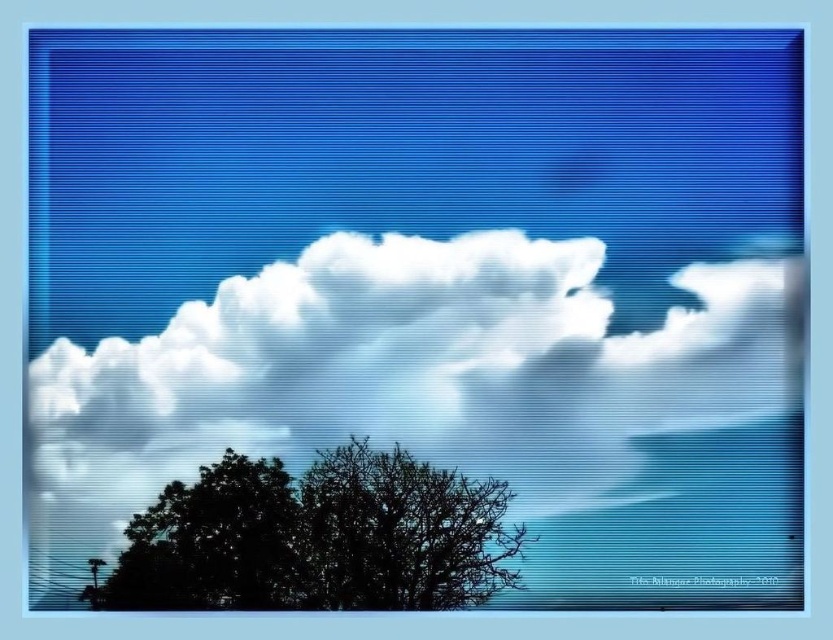
Based on the scene description, which silhouette leafy tree is wider between the silhouette leafy tree at lower center and the silhouette leafy tree at lower left?

The silhouette leafy tree at lower center might be wider than the silhouette leafy tree at lower left.

In the scene shown: You are standing at the origin point in the image and want to reach the point at the bottom right corner. There are two points in your path, point (427, 525) and point (242, 600). Which point is closer to your starting position?

Point (242, 600) is closer to the origin since it has a smaller distance from the starting point compared to point (427, 525).

You are an artist trying to paint the scene. You want to ensure the white fluffy cloud at upper center and the silhouette leafy tree at lower left are proportionally accurate. Which object should you paint larger?

The white fluffy cloud at upper center should be painted larger since it has a larger size compared to the silhouette leafy tree at lower left according to the description.